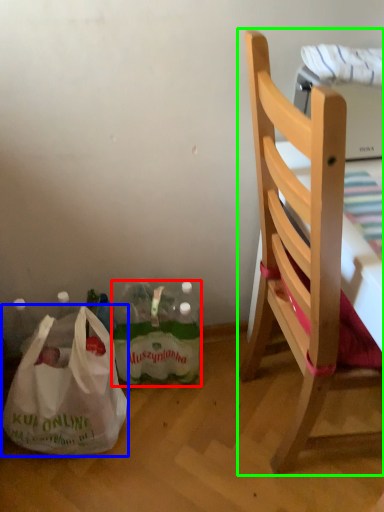
Question: Based on their relative distances, which object is farther from bottle (highlighted by a red box)? Choose from plastic bag (highlighted by a blue box) and chair (highlighted by a green box).

Choices:
 (A) plastic bag
 (B) chair

Answer: (B)